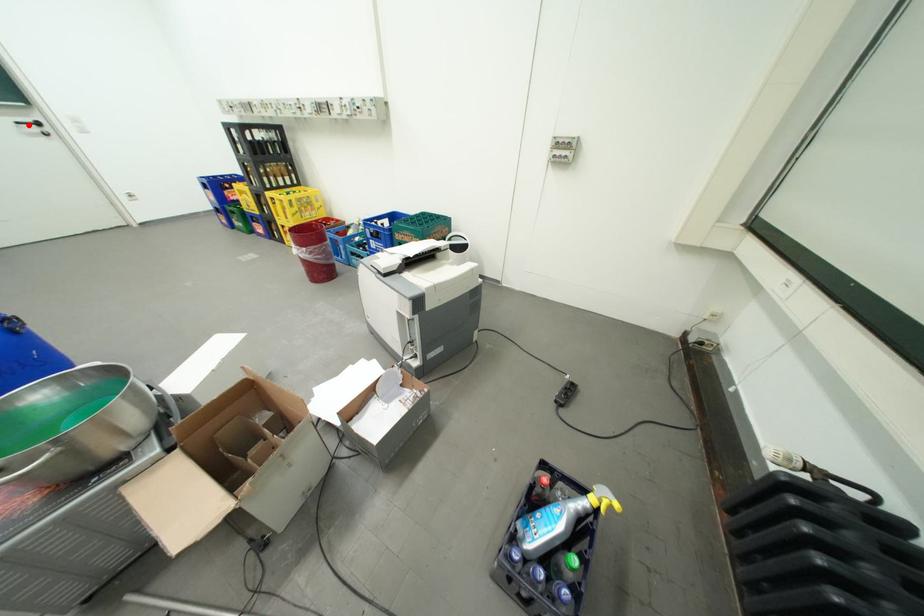
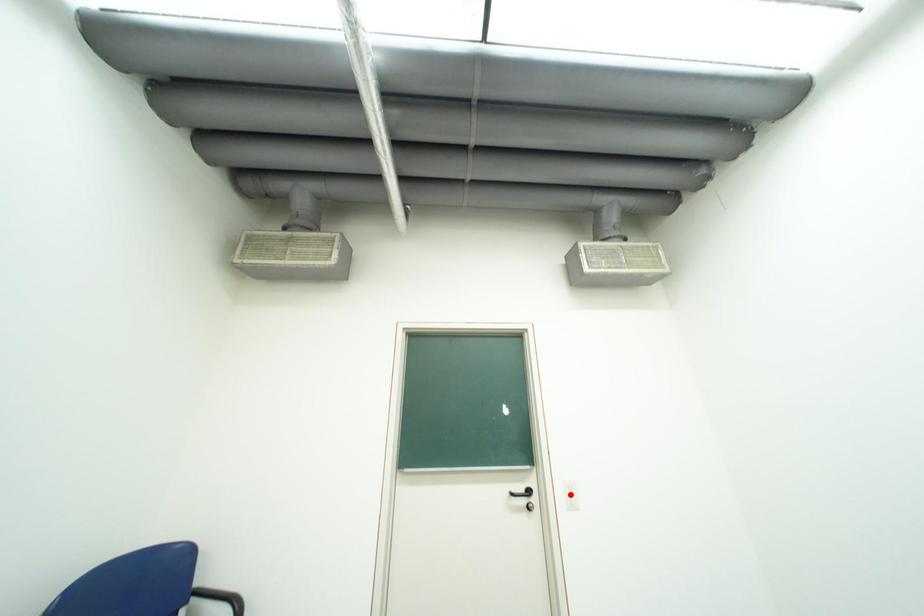
Based on the photo, I am providing you with two images of the same scene from different viewpoints. A red point is marked on the first image and another point is marked on the second image. Is the red point in image1 aligned with the point shown in image2?

No